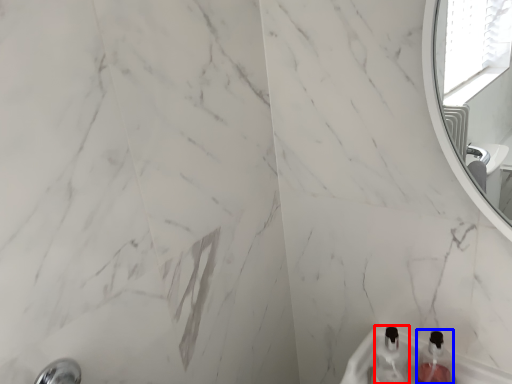
Question: Which object is further to the camera taking this photo, bottle (highlighted by a red box) or bottle (highlighted by a blue box)?

Choices:
 (A) bottle
 (B) bottle

Answer: (A)